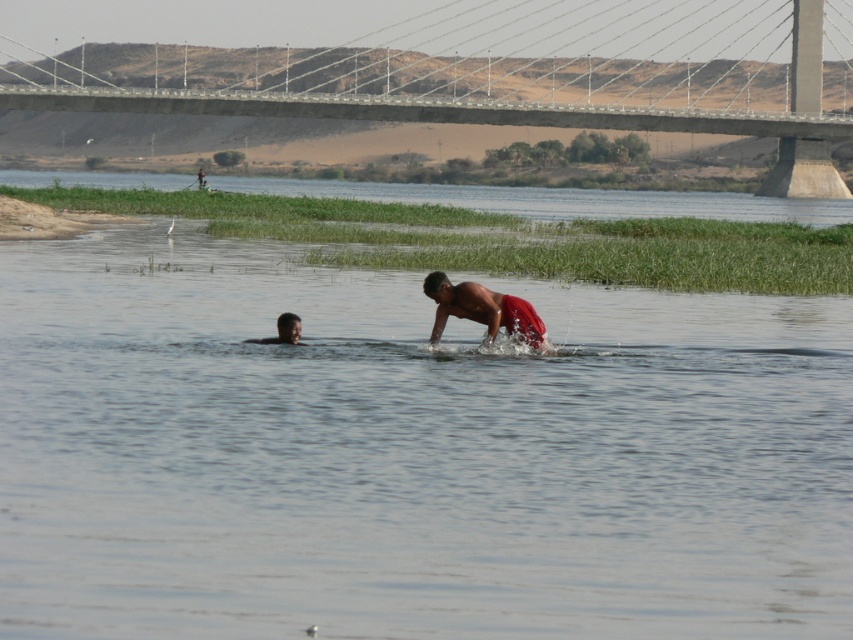
Does red fabric person at center come behind dark skin head at lower left?

No, it is not.

How much distance is there between red fabric person at center and dark skin head at lower left?

The distance of red fabric person at center from dark skin head at lower left is 1.86 meters.

At what (x,y) coordinates should I click in order to perform the action: click on red fabric person at center. Please return your answer as a coordinate pair (x, y). Looking at the image, I should click on click(x=482, y=308).

What do you see at coordinates (560, 198) in the screenshot? I see `clear water at river center` at bounding box center [560, 198].

Does clear water at river center appear on the left side of dark skin head at lower left?

Indeed, clear water at river center is positioned on the left side of dark skin head at lower left.

Is point (843, 211) closer to viewer compared to point (292, 339)?

No, it is behind (292, 339).

Find the location of a particular element. The image size is (853, 640). clear water at river center is located at coordinates (560, 198).

Is point (186, 600) positioned behind point (676, 195)?

That is False.

Is clear water at center positioned before clear water at river center?

Yes, clear water at center is in front of clear water at river center.

What do you see at coordinates (408, 452) in the screenshot? I see `clear water at center` at bounding box center [408, 452].

Where is `clear water at center`? The width and height of the screenshot is (853, 640). clear water at center is located at coordinates (408, 452).